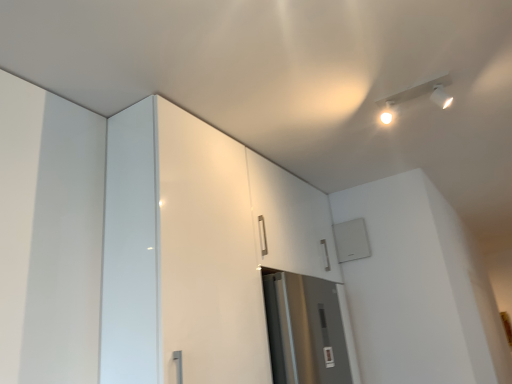
Question: Is white glossy cabinet at upper left in front of or behind white plastic track lighting at upper right in the image?

Choices:
 (A) front
 (B) behind

Answer: (A)

Question: In terms of size, does white glossy cabinet at upper left appear bigger or smaller than white plastic track lighting at upper right?

Choices:
 (A) small
 (B) big

Answer: (B)

Question: From the image's perspective, relative to white plastic track lighting at upper right, is white glossy cabinet at upper left above or below?

Choices:
 (A) above
 (B) below

Answer: (B)

Question: Is white plastic track lighting at upper right in front of or behind white glossy cabinet at upper left in the image?

Choices:
 (A) front
 (B) behind

Answer: (B)

Question: Considering the relative positions of white plastic track lighting at upper right and white glossy cabinet at upper left in the image provided, is white plastic track lighting at upper right to the left or to the right of white glossy cabinet at upper left?

Choices:
 (A) left
 (B) right

Answer: (B)

Question: Is point (422, 89) positioned closer to the camera than point (209, 359)?

Choices:
 (A) farther
 (B) closer

Answer: (A)

Question: From the image's perspective, is white plastic track lighting at upper right located above or below white glossy cabinet at upper left?

Choices:
 (A) above
 (B) below

Answer: (A)